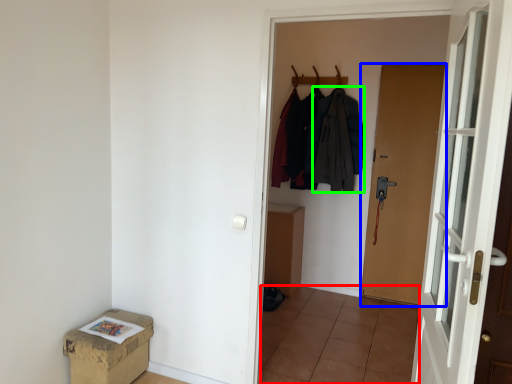
Question: Estimate the real-world distances between objects in this image. Which object is closer to tile (highlighted by a red box), door (highlighted by a blue box) or clothing (highlighted by a green box)?

Choices:
 (A) door
 (B) clothing

Answer: (A)